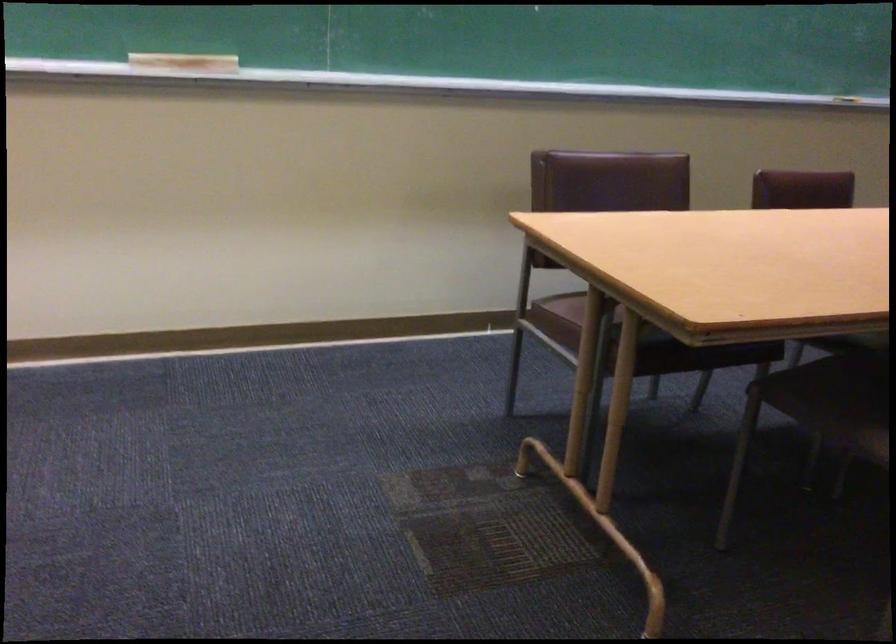
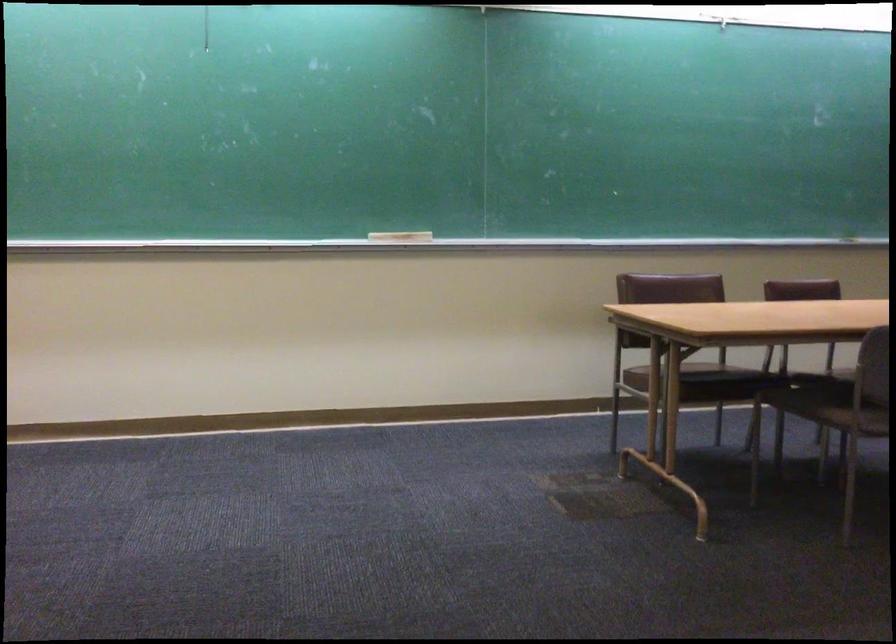
Where in the second image is the point corresponding to [570,308] from the first image?

(648, 368)